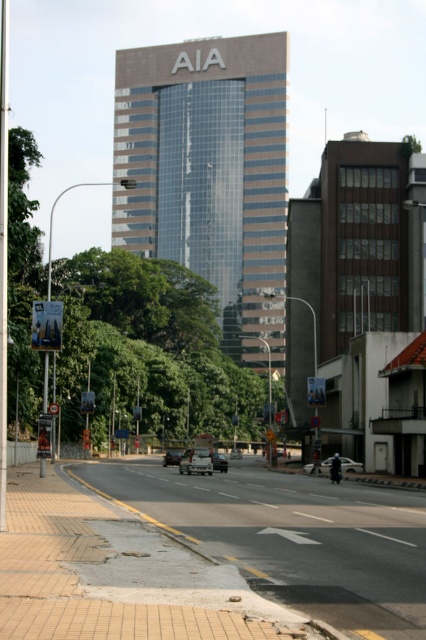
You are standing at the center of the road in this urban scene. Looking towards the concrete sidewalk at lower left, which direction should you walk to reach it?

The concrete sidewalk at lower left is located at point (291, 538), so you should walk towards the lower left direction to reach it.

You are standing at the camera position and want to throw a ball to the matte black car at center. If your throwing range is 40 meters, will you be able to reach it?

The distance between the matte black car at center and the camera is 45.20 meters, which exceeds your throwing range of 40 meters. Therefore, you won not be able to reach it.